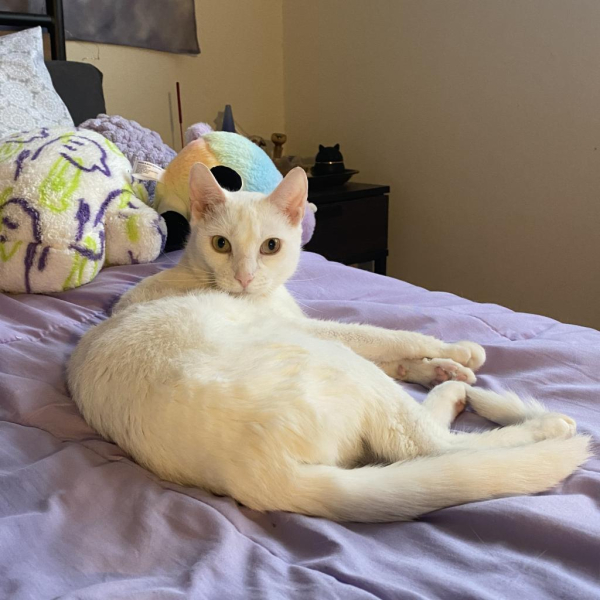
Locate an element on the screen. cusion is located at coordinates click(x=41, y=280).